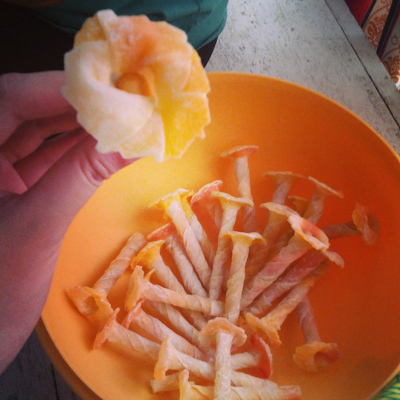
Where is `bowl`? The height and width of the screenshot is (400, 400). bowl is located at coordinates (326, 114).